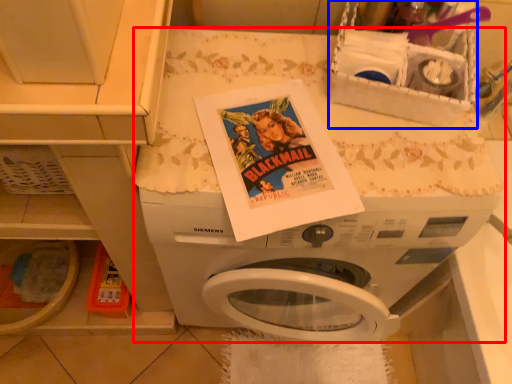
Question: Which point is further to the camera, washing machine (highlighted by a red box) or basket (highlighted by a blue box)?

Choices:
 (A) washing machine
 (B) basket

Answer: (A)